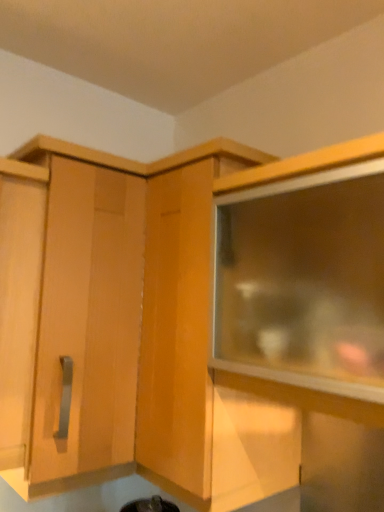
Question: From a real-world perspective, relative to wooden cabinet at center, the 1th cabinetry viewed from the right, is matte wood cabinet at upper left, placed as the first cabinetry when sorted from left to right, vertically above or below?

Choices:
 (A) below
 (B) above

Answer: (B)

Question: Based on their sizes in the image, would you say matte wood cabinet at upper left, placed as the first cabinetry when sorted from left to right, is bigger or smaller than wooden cabinet at center, the 1th cabinetry viewed from the right?

Choices:
 (A) small
 (B) big

Answer: (A)

Question: Which of these objects is positioned closest to the transparent glass cabinet at upper right?

Choices:
 (A) matte wood cabinet at upper left, placed as the first cabinetry when sorted from left to right
 (B) wooden cabinet at center, the 2th cabinetry viewed from the left

Answer: (B)

Question: Estimate the real-world distances between objects in this image. Which object is closer to the transparent glass cabinet at upper right?

Choices:
 (A) wooden cabinet at center, the 1th cabinetry viewed from the right
 (B) matte wood cabinet at upper left, the 2th cabinetry viewed from the right

Answer: (A)